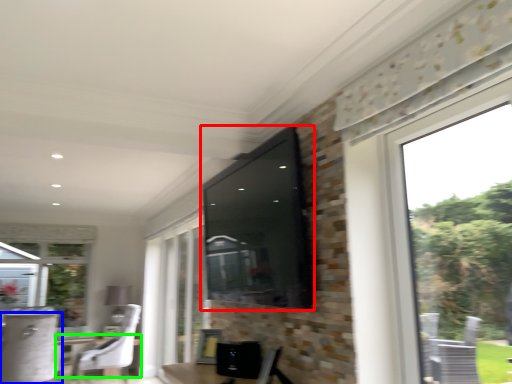
Question: Which object is the closest to the window screen (highlighted by a red box)? Choose among these: chair (highlighted by a blue box) or round table (highlighted by a green box).

Choices:
 (A) chair
 (B) round table

Answer: (A)